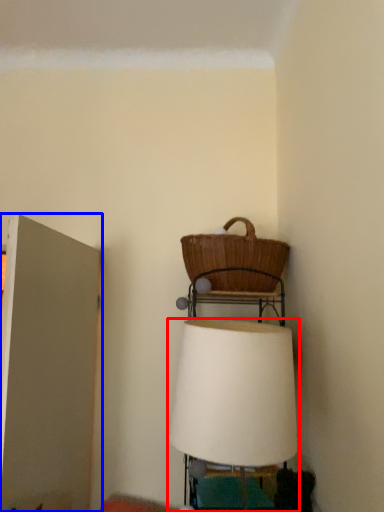
Question: Among these objects, which one is nearest to the camera, lamp (highlighted by a red box) or door (highlighted by a blue box)?

Choices:
 (A) lamp
 (B) door

Answer: (A)